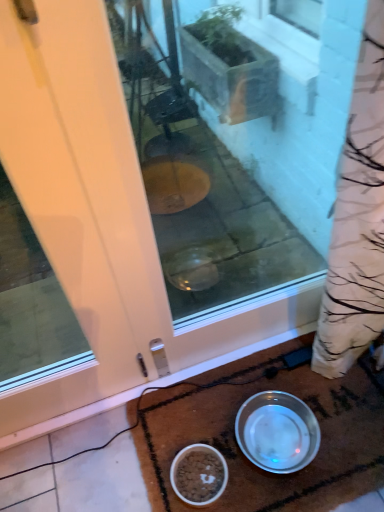
At what (x,y) coordinates should I click in order to perform the action: click on unoccupied space behind white glossy bowl at lower center, which is the 1th bowl in left-to-right order. Please return your answer as a coordinate pair (x, y). The width and height of the screenshot is (384, 512). Looking at the image, I should click on (187, 415).